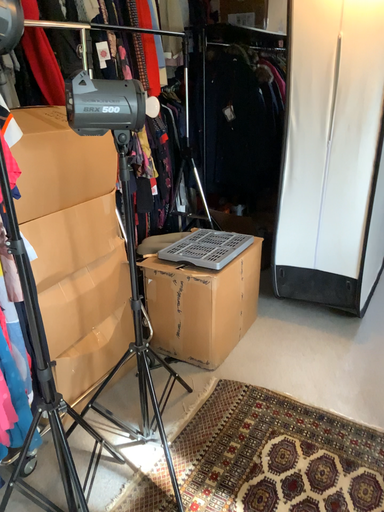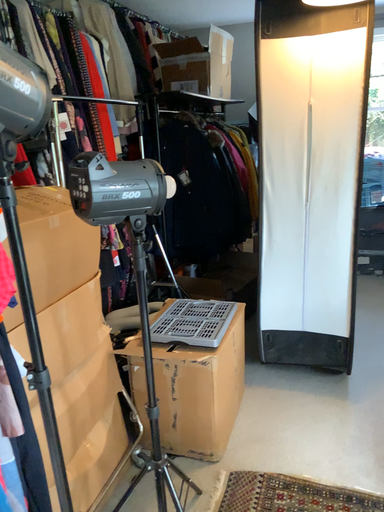
Question: How did the camera likely rotate when shooting the video?

Choices:
 (A) rotated downward
 (B) rotated upward

Answer: (B)